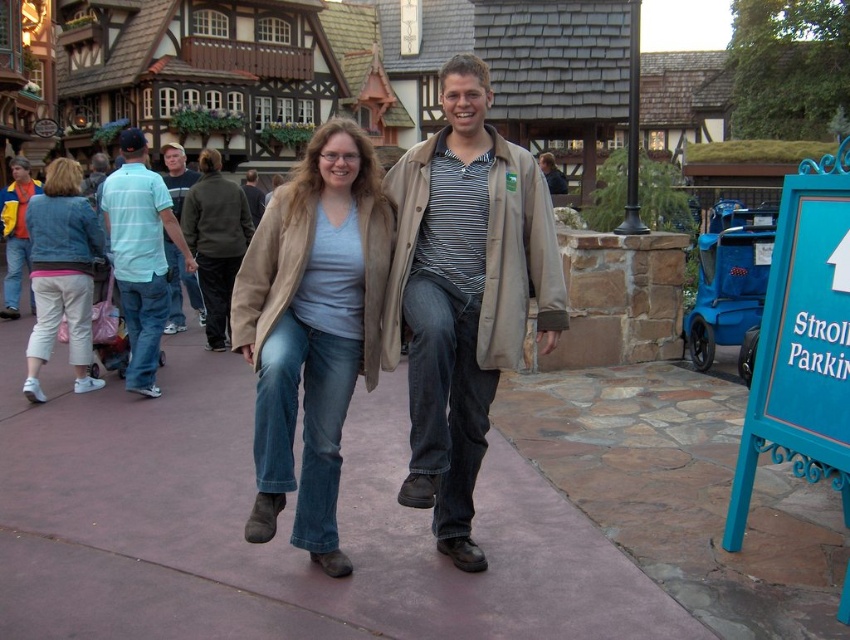
You are a tailor observing two pairs of jeans in the image. The light blue denim jeans at center and the dark blue jeans at center. Which pair has a narrower leg opening?

The light blue denim jeans at center has a narrower leg opening than the dark blue jeans at center.

You are a photographer trying to capture both the light blue denim jeans at center and the dark brown leather jacket at center in a single shot. Which clothing item would appear narrower in the photo?

The light blue denim jeans at center would appear narrower in the photo since it is thinner than the dark brown leather jacket at center.